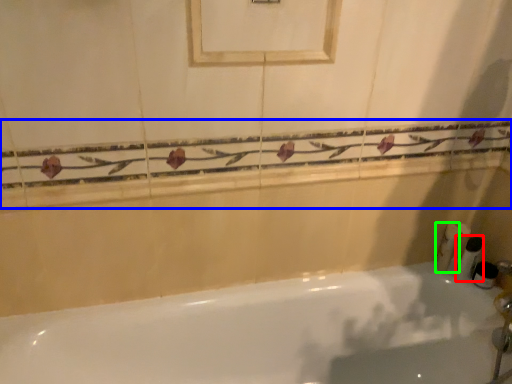
Question: Based on their relative distances, which object is farther from toiletry (highlighted by a red box)? Choose from balustrade (highlighted by a blue box) and toiletry (highlighted by a green box).

Choices:
 (A) balustrade
 (B) toiletry

Answer: (A)